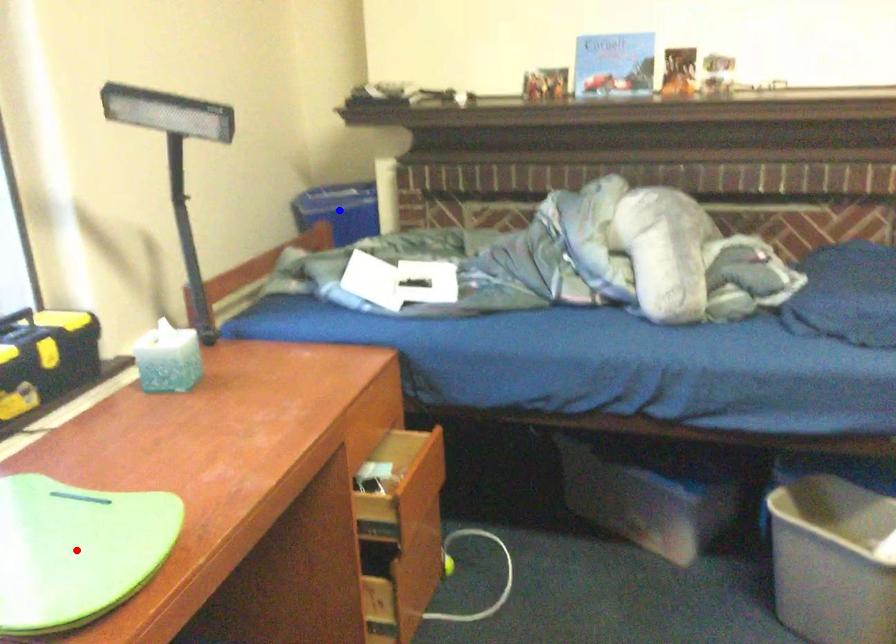
Question: Which of the two points in the image is closer to the camera?

Choices:
 (A) Blue point is closer.
 (B) Red point is closer.

Answer: (B)